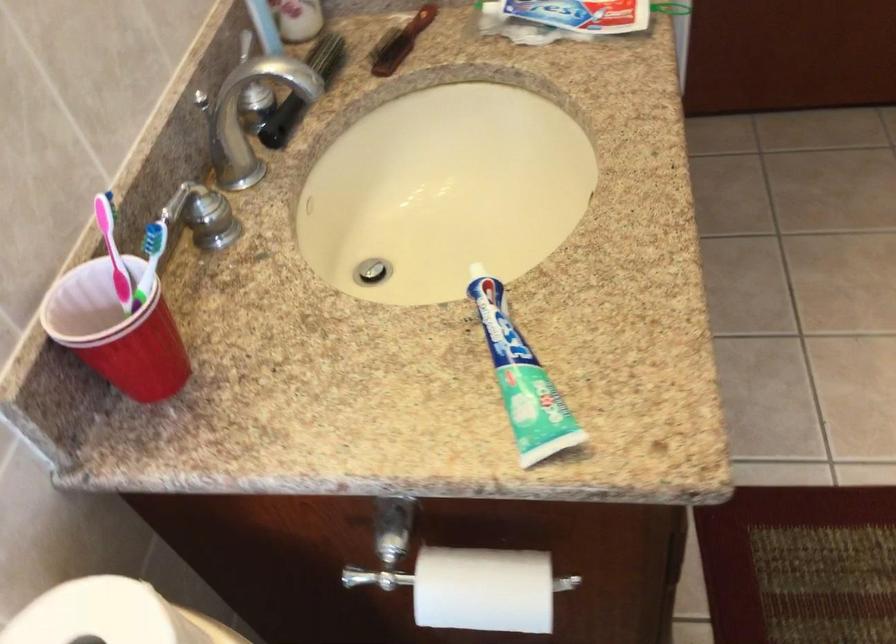
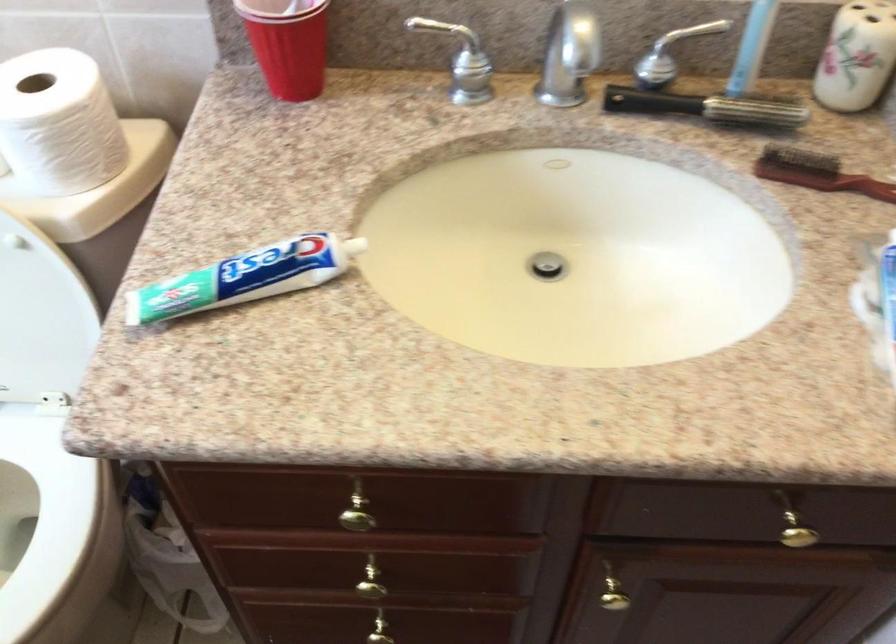
Question: I am providing you with two images of the same scene from different viewpoints. Which of the following objects are not visible in image2?

Choices:
 (A) black handle brush
 (B) toothbrush holder
 (C) red plastic cup
 (D) none of these

Answer: (D)